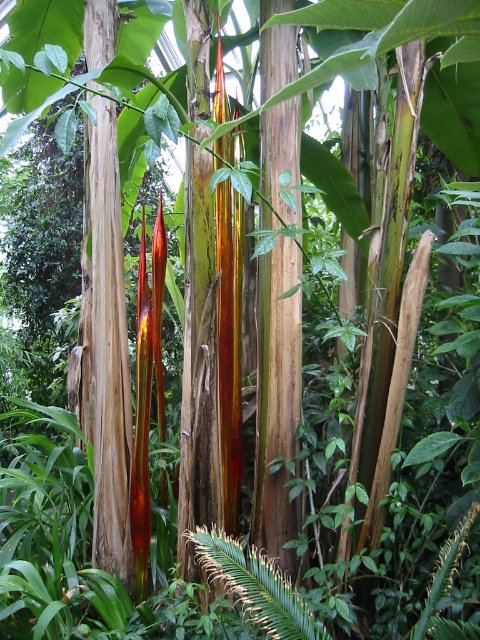
Question: Is smooth brown tree trunk at center to the left of green leafy fern at center from the viewer's perspective?

Choices:
 (A) yes
 (B) no

Answer: (A)

Question: Which point is closer to the camera?

Choices:
 (A) (116, 230)
 (B) (250, 612)

Answer: (B)

Question: Which point is farther from the camera taking this photo?

Choices:
 (A) (231, 560)
 (B) (126, 520)

Answer: (B)

Question: Does smooth brown tree trunk at center have a greater width compared to green leafy fern at center?

Choices:
 (A) yes
 (B) no

Answer: (B)

Question: Is smooth brown tree trunk at center smaller than green leafy fern at center?

Choices:
 (A) no
 (B) yes

Answer: (A)